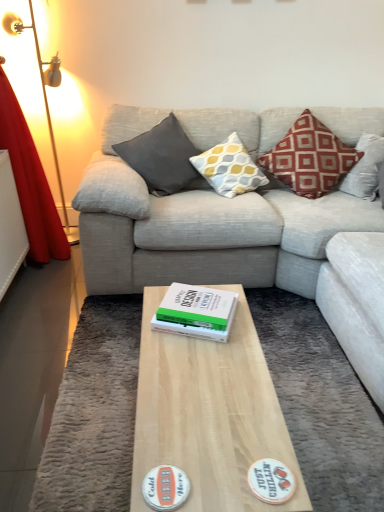
Question: Is white paper at center to the left or to the right of light gray fabric couch at center in the image?

Choices:
 (A) right
 (B) left

Answer: (B)

Question: Considering the positions of point (188, 287) and point (190, 207), is point (188, 287) closer or farther from the camera than point (190, 207)?

Choices:
 (A) closer
 (B) farther

Answer: (A)

Question: Which object is positioned closest to the light wood coffee table at center?

Choices:
 (A) yellow and gray patterned cushion at center, which is the 2th pillow in left-to-right order
 (B) white paper at center
 (C) light gray fabric couch at center
 (D) red velvet curtain at left
 (E) red cotton pillow at upper right, placed as the first pillow when sorted from right to left

Answer: (B)

Question: Based on their relative distances, which object is nearer to the matte gray cushion at center, arranged as the 3th pillow when viewed from the right?

Choices:
 (A) light wood coffee table at center
 (B) white paper at center
 (C) red velvet curtain at left
 (D) light gray fabric couch at center
 (E) matte white coaster at lower center, which ranks as the 2th sticker in right-to-left order

Answer: (D)